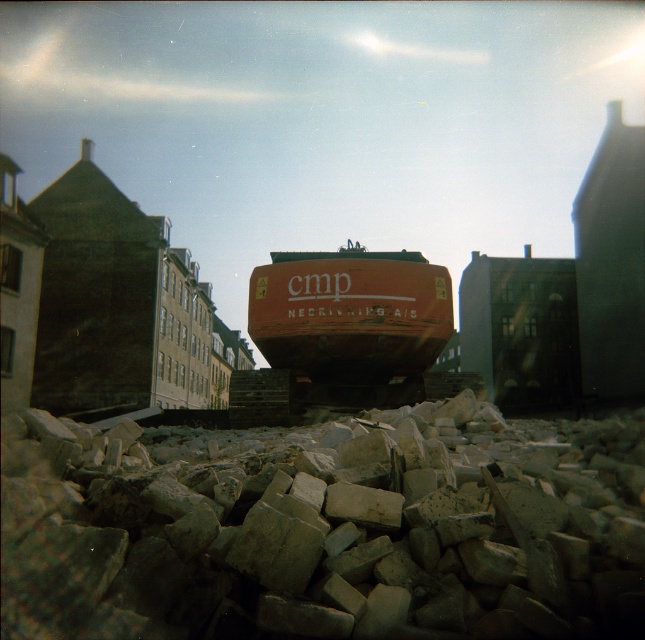
Measure the distance from gray rough gravel at lower center to rusty metal excavator at center.

26.86 feet

Between gray rough gravel at lower center and rusty metal excavator at center, which one is positioned lower?

Positioned lower is gray rough gravel at lower center.

Is point (622, 582) positioned in front of point (321, 291)?

Yes.

Identify the location of gray rough gravel at lower center. The height and width of the screenshot is (640, 645). (328, 536).